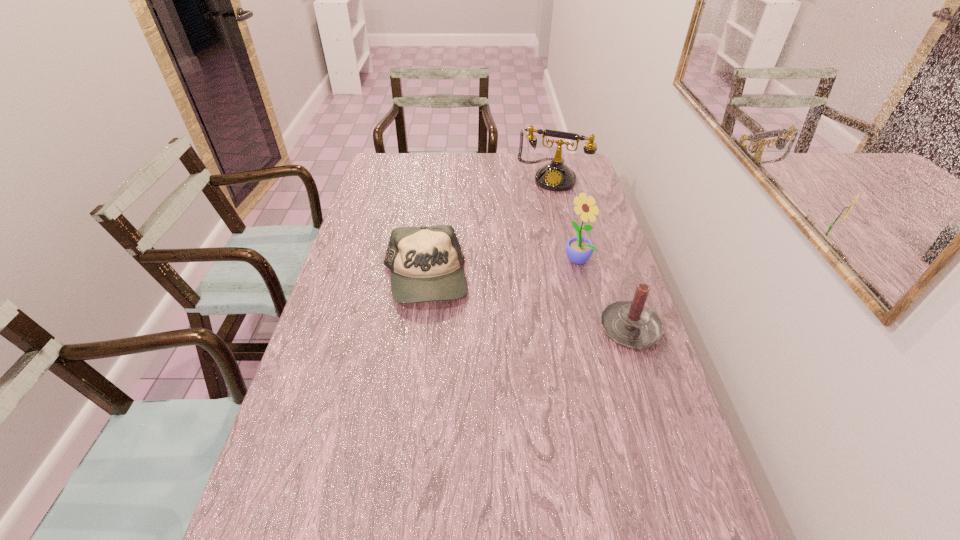
Find the location of a particular element. This screenshot has width=960, height=540. the leftmost object is located at coordinates (426, 263).

Identify the location of baseball cap. Image resolution: width=960 pixels, height=540 pixels. (426, 263).

Identify the location of the second shortest object. This screenshot has width=960, height=540. point(631,324).

This screenshot has height=540, width=960. I want to click on the farthest object, so click(555, 176).

The height and width of the screenshot is (540, 960). Identify the location of the third shortest object. (555, 176).

Identify the location of sunflower. (579, 250).

This screenshot has width=960, height=540. In order to click on free spot located on the front-facing side of the baseball cap in this screenshot , I will do (x=411, y=386).

Where is `vacant space located on the side of the candle with the handle loop`? vacant space located on the side of the candle with the handle loop is located at coordinates point(670,455).

You are a GUI agent. You are given a task and a screenshot of the screen. Output one action in this format:
    pyautogui.click(x=<x>, y=<y>)
    Task: Click on the free space located 0.230m on the dial of the third shortest object
    The width and height of the screenshot is (960, 540).
    Given the screenshot: What is the action you would take?
    coord(529,224)

What are the coordinates of `vacant space located on the dial of the third shortest object` in the screenshot? It's located at (516, 253).